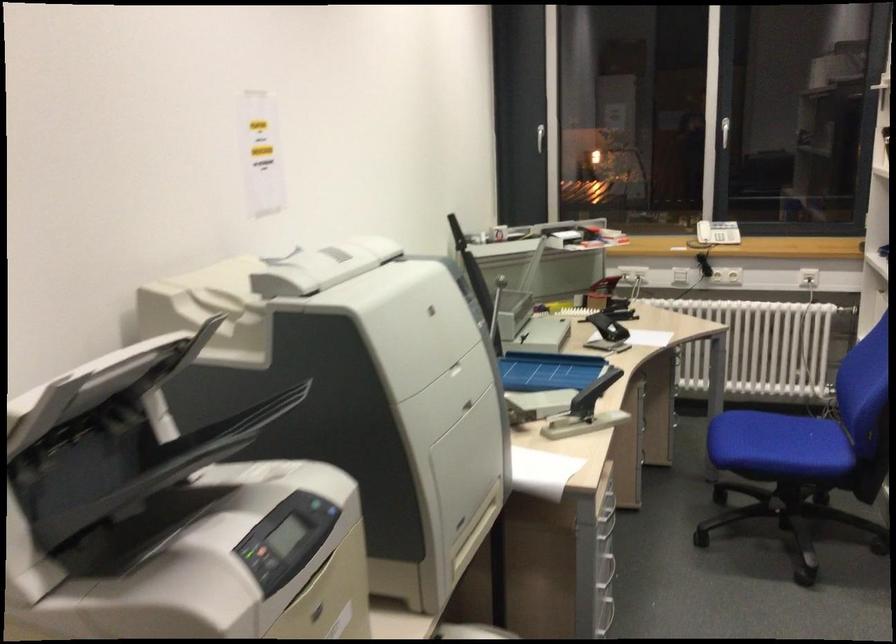
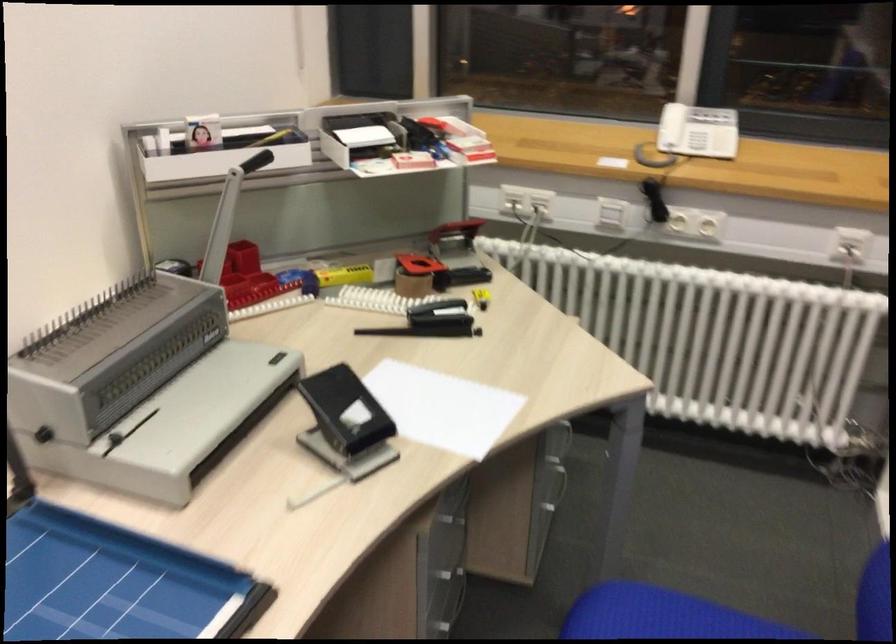
Find the pixel in the second image that matches [599,238] in the first image.

(421, 160)